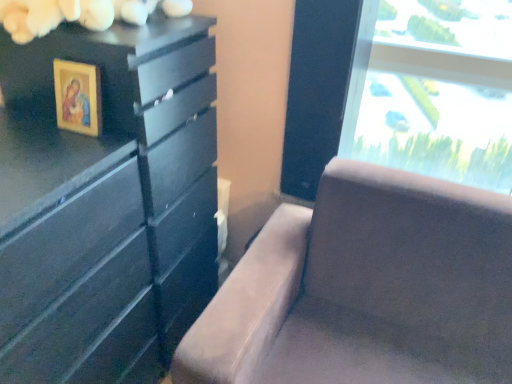
Question: Is wooden framed picture at upper left behind suede-like brown couch at center?

Choices:
 (A) no
 (B) yes

Answer: (B)

Question: From the image's perspective, does wooden framed picture at upper left appear higher than suede-like brown couch at center?

Choices:
 (A) no
 (B) yes

Answer: (B)

Question: Is wooden framed picture at upper left positioned before suede-like brown couch at center?

Choices:
 (A) no
 (B) yes

Answer: (A)

Question: From a real-world perspective, is wooden framed picture at upper left physically below suede-like brown couch at center?

Choices:
 (A) yes
 (B) no

Answer: (B)

Question: Is wooden framed picture at upper left outside of suede-like brown couch at center?

Choices:
 (A) no
 (B) yes

Answer: (B)

Question: From the image's perspective, is wooden framed picture at upper left beneath suede-like brown couch at center?

Choices:
 (A) no
 (B) yes

Answer: (A)

Question: Would you say wooden framed picture at upper left is part of matte black dresser at left's contents?

Choices:
 (A) no
 (B) yes

Answer: (A)

Question: Is matte black dresser at left bigger than wooden framed picture at upper left?

Choices:
 (A) no
 (B) yes

Answer: (B)

Question: Does matte black dresser at left appear on the left side of wooden framed picture at upper left?

Choices:
 (A) no
 (B) yes

Answer: (A)

Question: Are matte black dresser at left and wooden framed picture at upper left located far from each other?

Choices:
 (A) no
 (B) yes

Answer: (A)

Question: Could you tell me if matte black dresser at left is facing wooden framed picture at upper left?

Choices:
 (A) no
 (B) yes

Answer: (A)

Question: From a real-world perspective, is matte black dresser at left positioned under wooden framed picture at upper left based on gravity?

Choices:
 (A) no
 (B) yes

Answer: (B)

Question: Can you confirm if matte black dresser at left is shorter than suede-like brown couch at center?

Choices:
 (A) no
 (B) yes

Answer: (A)